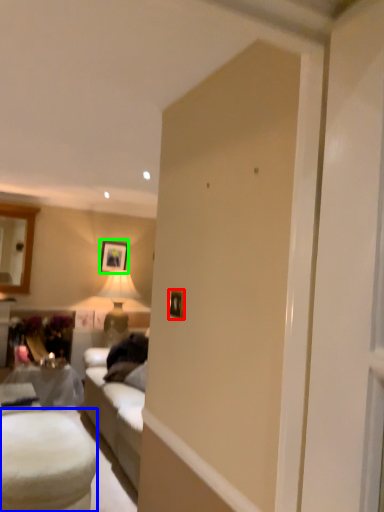
Question: Which object is the farthest from picture frame (highlighted by a red box)? Choose among these: table (highlighted by a blue box) or picture frame (highlighted by a green box).

Choices:
 (A) table
 (B) picture frame

Answer: (B)